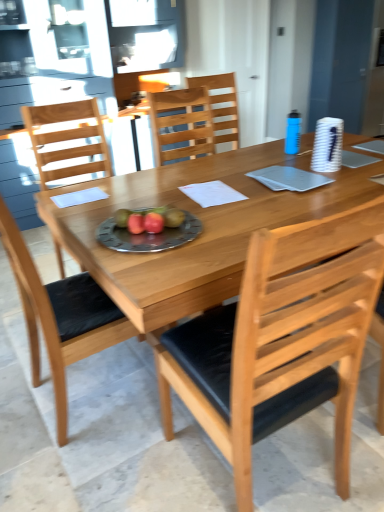
Locate an element on the screen. The image size is (384, 512). vacant area situated to the left side of natural wood chair at center, arranged as the first chair when viewed from the front is located at coordinates (117, 468).